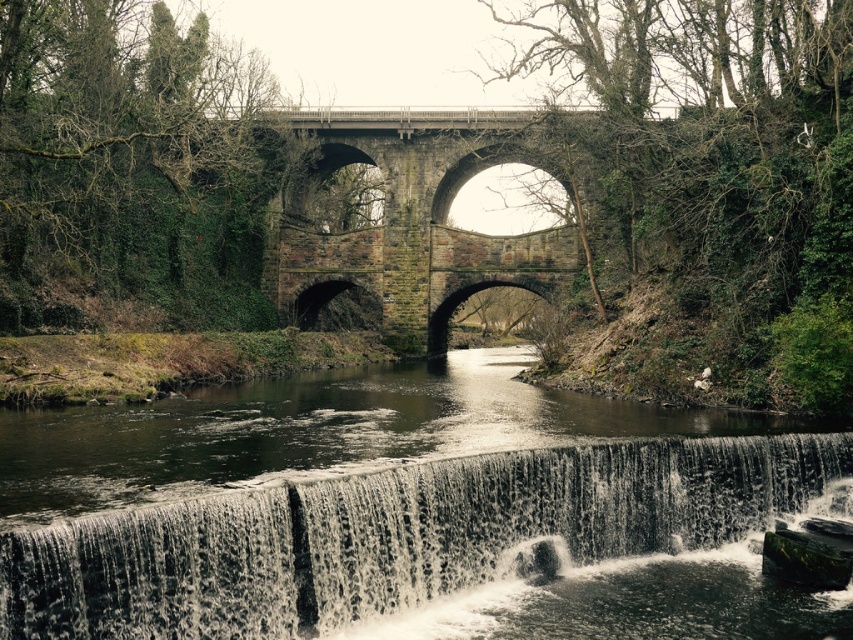
Question: Is dark gray textured water at lower center to the right of stone arch bridge at center from the viewer's perspective?

Choices:
 (A) no
 (B) yes

Answer: (A)

Question: Is dark gray textured water at lower center above stone arch bridge at center?

Choices:
 (A) yes
 (B) no

Answer: (B)

Question: Is dark gray textured water at lower center wider than stone arch bridge at center?

Choices:
 (A) no
 (B) yes

Answer: (A)

Question: Which of the following is the farthest from the observer?

Choices:
 (A) (427, 257)
 (B) (407, 609)

Answer: (A)

Question: Which point is farther to the camera?

Choices:
 (A) stone arch bridge at center
 (B) dark gray textured water at lower center

Answer: (A)